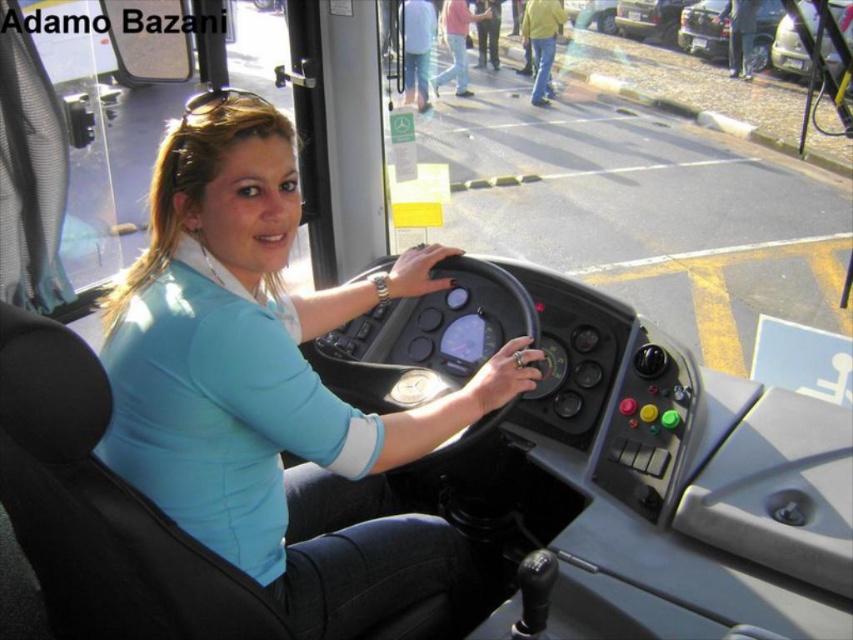
You are a passenger on the bus and want to know if the blue fabric shirt at center is bigger than the metallic silver car at upper right. Based on the scene, can you determine which object is larger?

The blue fabric shirt at center has a larger size compared to metallic silver car at upper right, so the blue fabric shirt at center is bigger.

You are standing at the bus stop waiting for the bus to arrive. When the bus arrives, you notice the driver wearing a blue fabric shirt at center. If you want to wave to the driver, will you be able to see their face clearly from your position at the bus stop?

The blue fabric shirt at center is 36.20 inches away from you. Since the shirt is part of the driver, this distance suggests the driver is close enough for you to see their face clearly when waving from the bus stop.